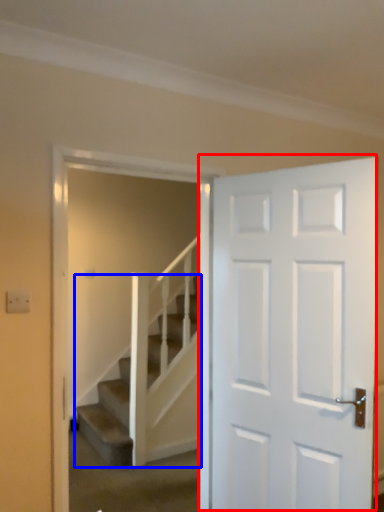
Question: Which point is closer to the camera, door (highlighted by a red box) or stairs (highlighted by a blue box)?

Choices:
 (A) door
 (B) stairs

Answer: (A)